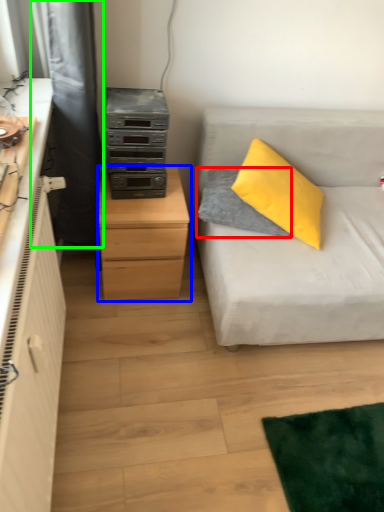
Question: Which object is the farthest from pillow (highlighted by a red box)? Choose among these: chest of drawers (highlighted by a blue box) or curtain (highlighted by a green box).

Choices:
 (A) chest of drawers
 (B) curtain

Answer: (B)